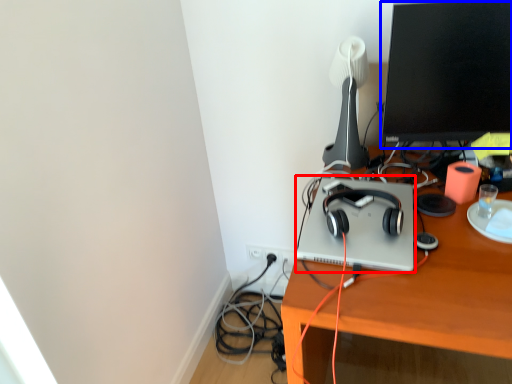
Question: Which object appears farthest to the camera in this image, computer (highlighted by a red box) or computer monitor (highlighted by a blue box)?

Choices:
 (A) computer
 (B) computer monitor

Answer: (B)